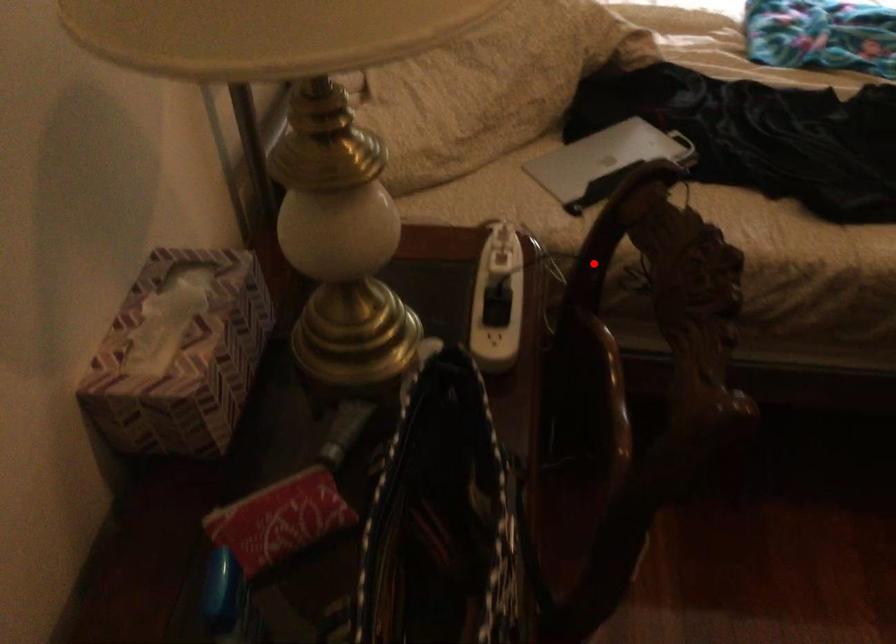
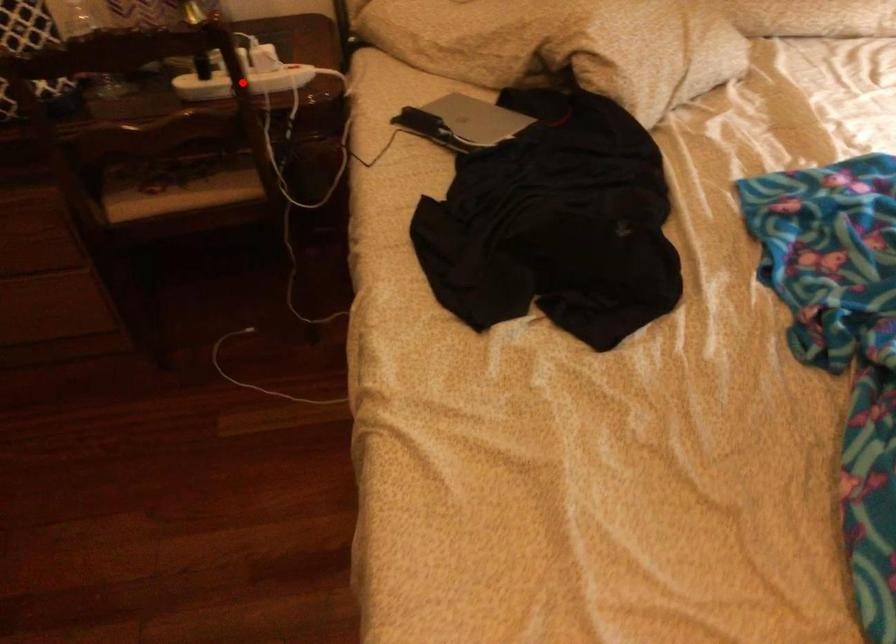
I am providing you with two images of the same scene from different viewpoints. A red point is marked on the first image and another point is marked on the second image. Do the highlighted points in image1 and image2 indicate the same real-world spot?

Yes